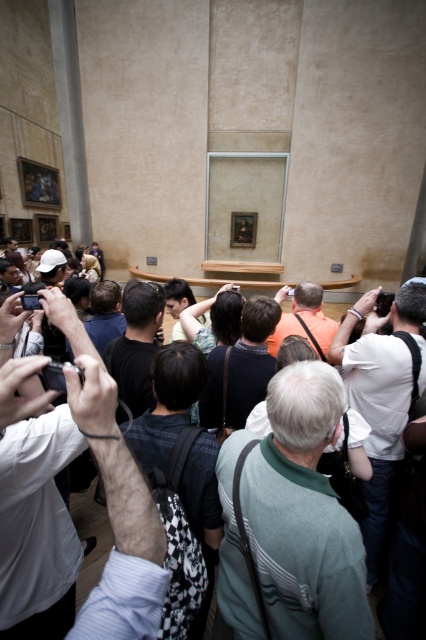
Does green striped sweater at center have a lesser height compared to matte black camera at center?

No.

What do you see at coordinates (304, 513) in the screenshot? The height and width of the screenshot is (640, 426). I see `green striped sweater at center` at bounding box center [304, 513].

Between point (222, 467) and point (120, 618), which one is positioned in front?

Positioned in front is point (120, 618).

You are a GUI agent. You are given a task and a screenshot of the screen. Output one action in this format:
    pyautogui.click(x=<x>, y=<y>)
    Task: Click on the green striped sweater at center
    
    Given the screenshot: What is the action you would take?
    pyautogui.click(x=304, y=513)

Describe the element at coordinates (103, 480) in the screenshot. This screenshot has height=640, width=426. I see `white matte camera at center` at that location.

Does white matte camera at center appear on the right side of matte black camera at center?

Yes, white matte camera at center is to the right of matte black camera at center.

Identify the location of white matte camera at center. (103, 480).

The width and height of the screenshot is (426, 640). In order to click on white matte camera at center in this screenshot , I will do [x=103, y=480].

Is green striped sweater at center smaller than white matte camera at center?

Actually, green striped sweater at center might be larger than white matte camera at center.

Does green striped sweater at center have a lesser height compared to white matte camera at center?

Incorrect, green striped sweater at center's height does not fall short of white matte camera at center's.

Image resolution: width=426 pixels, height=640 pixels. What are the coordinates of `green striped sweater at center` in the screenshot? It's located at (304, 513).

At what (x,y) coordinates should I click in order to perform the action: click on green striped sweater at center. Please return your answer as a coordinate pair (x, y). Image resolution: width=426 pixels, height=640 pixels. Looking at the image, I should click on (304, 513).